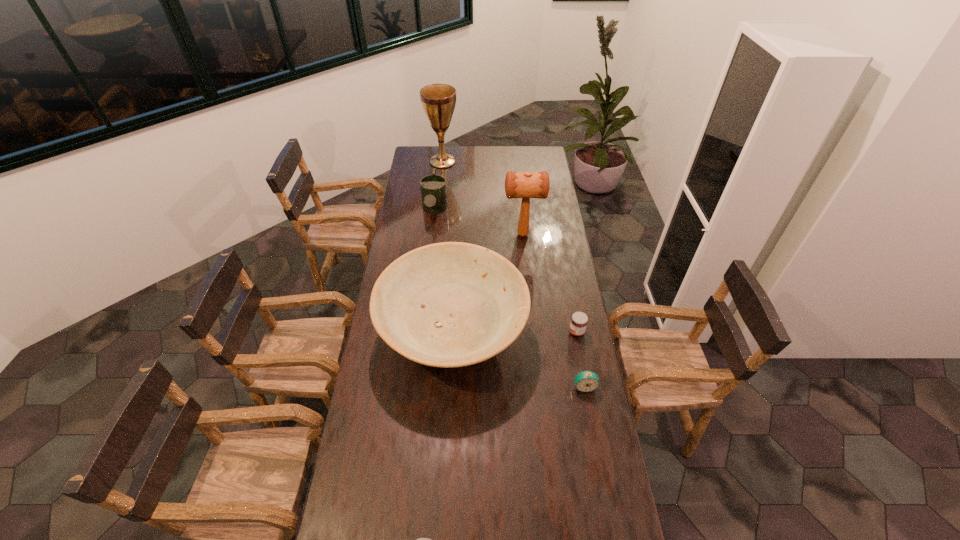
Image resolution: width=960 pixels, height=540 pixels. What are the coordinates of `vacant space located 0.220m on the strike surface of the second tallest object` in the screenshot? It's located at (459, 235).

The height and width of the screenshot is (540, 960). Find the location of `vacant area situated 0.250m on the back of the fifth shortest object`. vacant area situated 0.250m on the back of the fifth shortest object is located at coordinates (458, 246).

Find the location of a particular element. The image size is (960, 540). free spot located 0.180m with the spout on the watering can is located at coordinates (429, 254).

Where is `free space located 0.220m on the front-facing side of the alarm clock`? This screenshot has width=960, height=540. free space located 0.220m on the front-facing side of the alarm clock is located at coordinates (596, 452).

I want to click on free space located 0.060m on the left of the jam, so click(554, 332).

Where is `object that is at the far edge`? This screenshot has height=540, width=960. object that is at the far edge is located at coordinates (438, 100).

At what (x,y) coordinates should I click in order to perform the action: click on trophy cup present at the left edge. Please return your answer as a coordinate pair (x, y). Image resolution: width=960 pixels, height=540 pixels. Looking at the image, I should click on (438, 100).

Locate an element on the screen. The width and height of the screenshot is (960, 540). dish located in the left edge section of the desktop is located at coordinates (452, 304).

I want to click on watering can present at the left edge, so click(x=433, y=187).

Where is `mallet present at the right edge`? mallet present at the right edge is located at coordinates (525, 185).